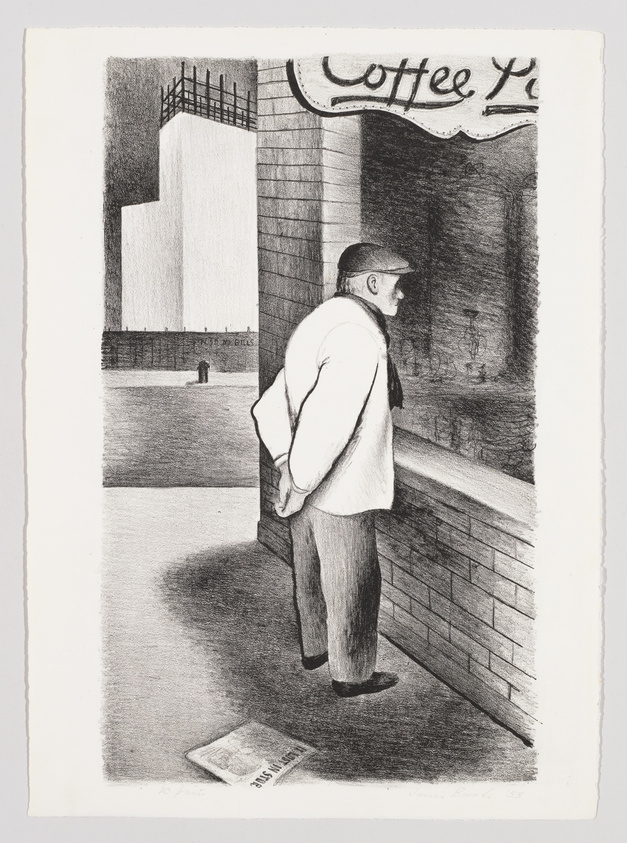
You are a GUI agent. You are given a task and a screenshot of the screen. Output one action in this format:
    pyautogui.click(x=<x>, y=<y>)
    Task: Click on the wooden wall
    This screenshot has height=843, width=627.
    Given the screenshot: What is the action you would take?
    pyautogui.click(x=176, y=344)